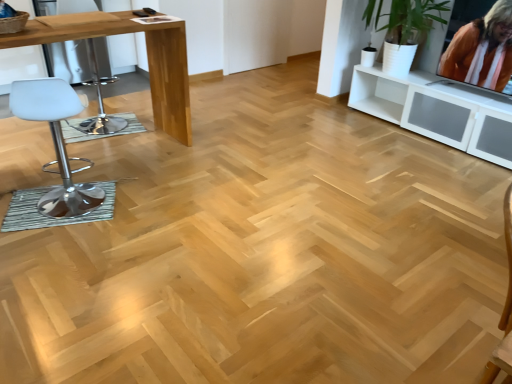
Question: Does white plastic swivel chair at left have a larger size compared to light brown glossy table at left?

Choices:
 (A) yes
 (B) no

Answer: (B)

Question: Is white plastic swivel chair at left far away from light brown glossy table at left?

Choices:
 (A) yes
 (B) no

Answer: (A)

Question: Does white plastic swivel chair at left have a greater width compared to light brown glossy table at left?

Choices:
 (A) no
 (B) yes

Answer: (A)

Question: Is light brown glossy table at left at the back of white plastic swivel chair at left?

Choices:
 (A) yes
 (B) no

Answer: (B)

Question: Is the position of white plastic swivel chair at left less distant than that of light brown glossy table at left?

Choices:
 (A) no
 (B) yes

Answer: (A)

Question: Can you confirm if white plastic swivel chair at left is thinner than light brown glossy table at left?

Choices:
 (A) yes
 (B) no

Answer: (A)

Question: Considering the relative sizes of white plastic swivel chair at left and orange fabric at upper right in the image provided, is white plastic swivel chair at left taller than orange fabric at upper right?

Choices:
 (A) yes
 (B) no

Answer: (A)

Question: Can you confirm if white plastic swivel chair at left is smaller than orange fabric at upper right?

Choices:
 (A) yes
 (B) no

Answer: (B)

Question: Does white plastic swivel chair at left come in front of orange fabric at upper right?

Choices:
 (A) yes
 (B) no

Answer: (B)

Question: Is white plastic swivel chair at left facing towards orange fabric at upper right?

Choices:
 (A) no
 (B) yes

Answer: (A)

Question: Is white plastic swivel chair at left at the left side of orange fabric at upper right?

Choices:
 (A) yes
 (B) no

Answer: (A)

Question: Is white plastic swivel chair at left oriented away from orange fabric at upper right?

Choices:
 (A) no
 (B) yes

Answer: (A)

Question: Is orange fabric at upper right next to white leather stool at left and touching it?

Choices:
 (A) yes
 (B) no

Answer: (B)